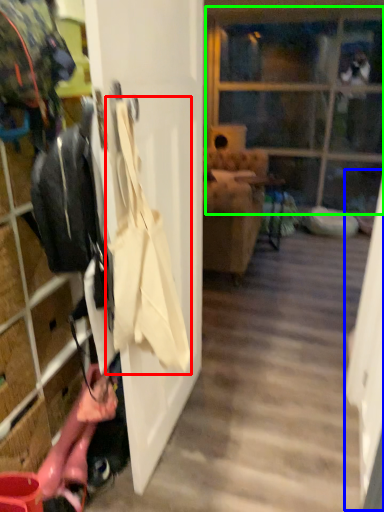
Question: Considering the real-world distances, which object is closest to shoulder bag (highlighted by a red box)? screen door (highlighted by a blue box) or glass door (highlighted by a green box).

Choices:
 (A) screen door
 (B) glass door

Answer: (A)